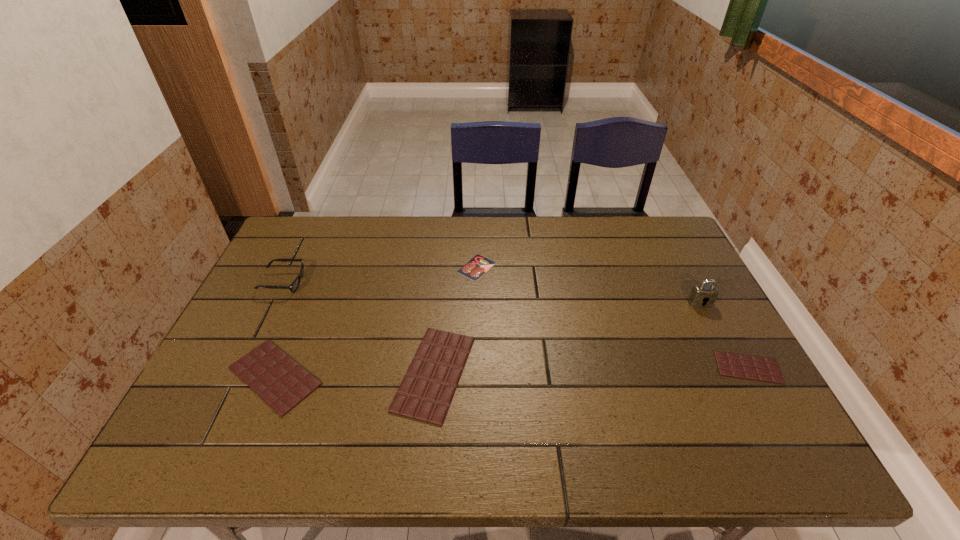
Image resolution: width=960 pixels, height=540 pixels. I want to click on vacant region that satisfies the following two spatial constraints: 1. at the front of the padlock near the keyhole; 2. on the right side of the shortest chocolate bar, so click(x=733, y=367).